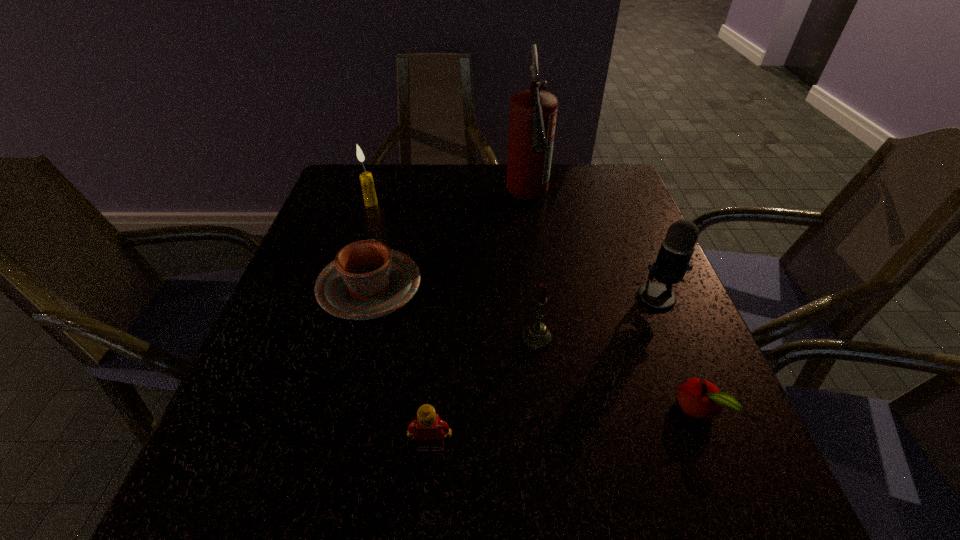
Identify which object is the fifth nearest to the nearer candle. Please provide its 2D coordinates. Your answer should be formatted as a tuple, i.e. [(x, y)], where the tuple contains the x and y coordinates of a point satisfying the conditions above.

[(533, 113)]

At what (x,y) coordinates should I click in order to perform the action: click on free location that satisfies the following two spatial constraints: 1. on the back side of the microphone; 2. on the left side of the nearer candle. Please return your answer as a coordinate pair (x, y). This screenshot has width=960, height=540. Looking at the image, I should click on (532, 297).